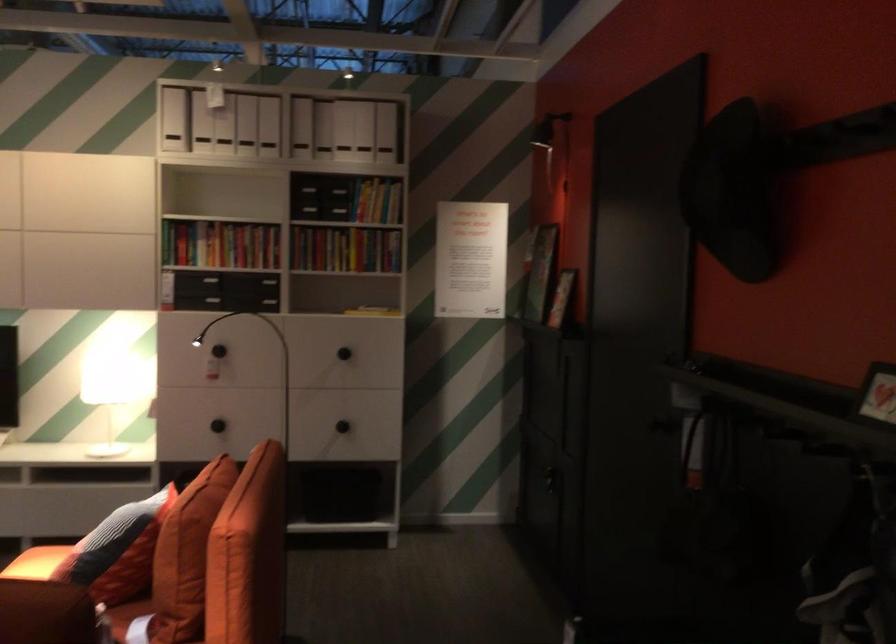
The image size is (896, 644). What are the coordinates of `sofa sitting surface` in the screenshot? It's located at (36, 563).